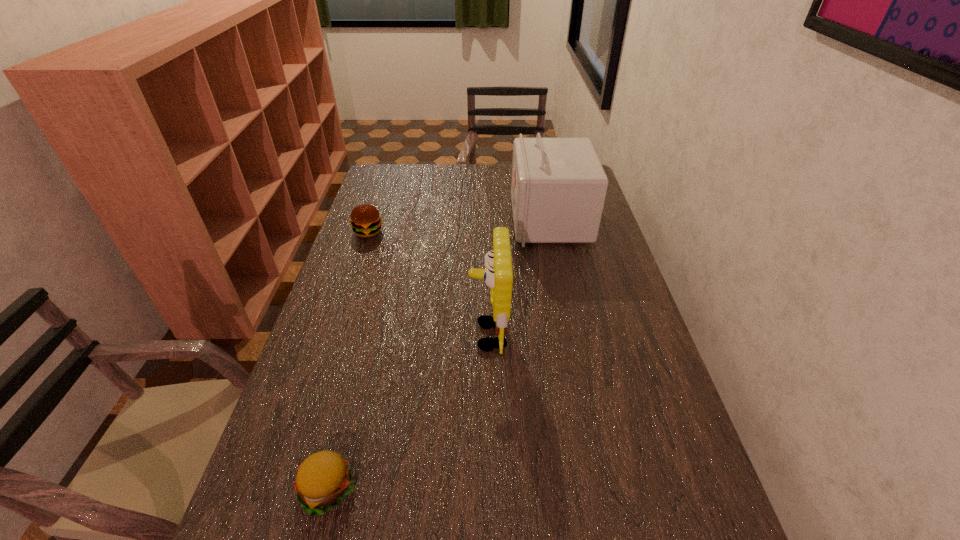
Locate an element on the screen. The image size is (960, 540). vacant space located 0.140m on the face of the third farthest object is located at coordinates coord(417,335).

Image resolution: width=960 pixels, height=540 pixels. In order to click on blank space located on the face of the third farthest object in this screenshot , I will do `click(413, 335)`.

The width and height of the screenshot is (960, 540). Find the location of `free spot located 0.320m on the face of the third farthest object`. free spot located 0.320m on the face of the third farthest object is located at coordinates (348, 335).

Find the location of a particular element. The image size is (960, 540). vacant point located 0.260m on the right of the second shortest object is located at coordinates (460, 232).

At what (x,y) coordinates should I click in order to perform the action: click on free space located 0.330m on the right of the shortest object. Please return your answer as a coordinate pair (x, y). This screenshot has width=960, height=540. Looking at the image, I should click on (524, 489).

This screenshot has height=540, width=960. Find the location of `object at the right edge`. object at the right edge is located at coordinates (558, 189).

The image size is (960, 540). I want to click on blank space at the far edge of the desktop, so click(x=509, y=176).

You are a GUI agent. You are given a task and a screenshot of the screen. Output one action in this format:
    pyautogui.click(x=<x>, y=<y>)
    Task: Click on the free space at the left edge of the desktop
    The height and width of the screenshot is (540, 960).
    Given the screenshot: What is the action you would take?
    pyautogui.click(x=334, y=300)

I want to click on free region at the right edge of the desktop, so click(x=624, y=298).

You are a GUI agent. You are given a task and a screenshot of the screen. Output one action in this format:
    pyautogui.click(x=<x>, y=<y>)
    Task: Click on the free space at the far left corner of the desktop
    The height and width of the screenshot is (540, 960).
    Given the screenshot: What is the action you would take?
    pyautogui.click(x=396, y=190)